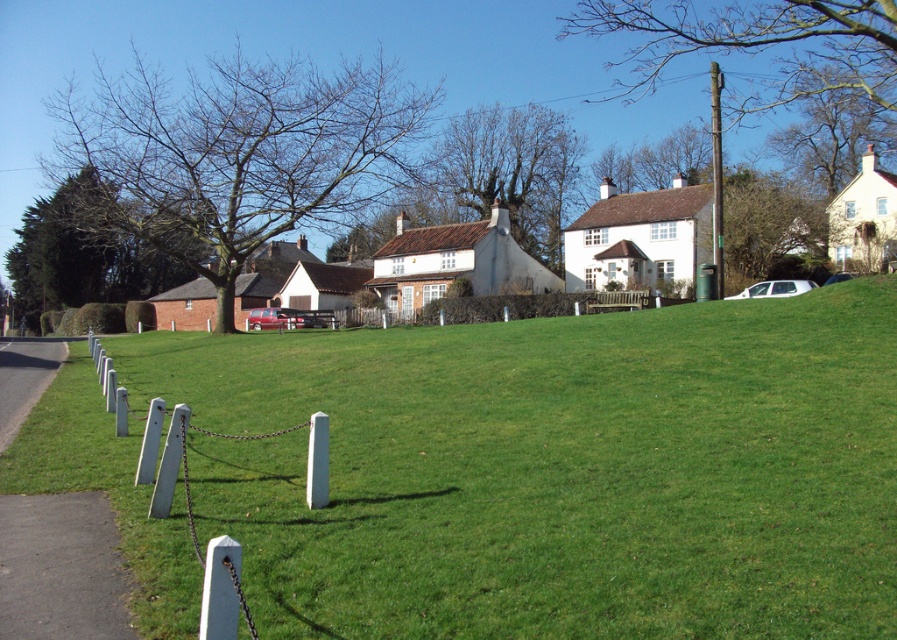
Question: Which object is the closest to the green metallic pole at upper right?

Choices:
 (A) white matte car at right
 (B) green grass at center

Answer: (A)

Question: Can you confirm if green metallic pole at upper right is wider than metallic silver car at center?

Choices:
 (A) yes
 (B) no

Answer: (A)

Question: Which object appears farthest from the camera in this image?

Choices:
 (A) green grass at center
 (B) green metallic pole at upper right
 (C) metallic silver car at center

Answer: (C)

Question: Which of the following is the closest to the observer?

Choices:
 (A) (667, 344)
 (B) (720, 182)
 (C) (782, 289)
 (D) (264, 321)

Answer: (A)

Question: Is green metallic pole at upper right to the right of metallic silver car at center from the viewer's perspective?

Choices:
 (A) no
 (B) yes

Answer: (B)

Question: Is green grass at center to the right of white matte car at right from the viewer's perspective?

Choices:
 (A) yes
 (B) no

Answer: (B)